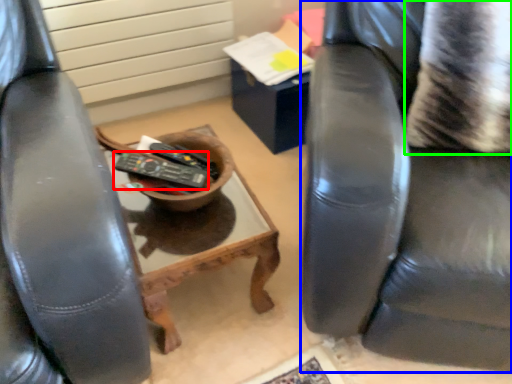
Question: Estimate the real-world distances between objects in this image. Which object is farther from remote control (highlighted by a red box), chair (highlighted by a blue box) or pillow (highlighted by a green box)?

Choices:
 (A) chair
 (B) pillow

Answer: (B)